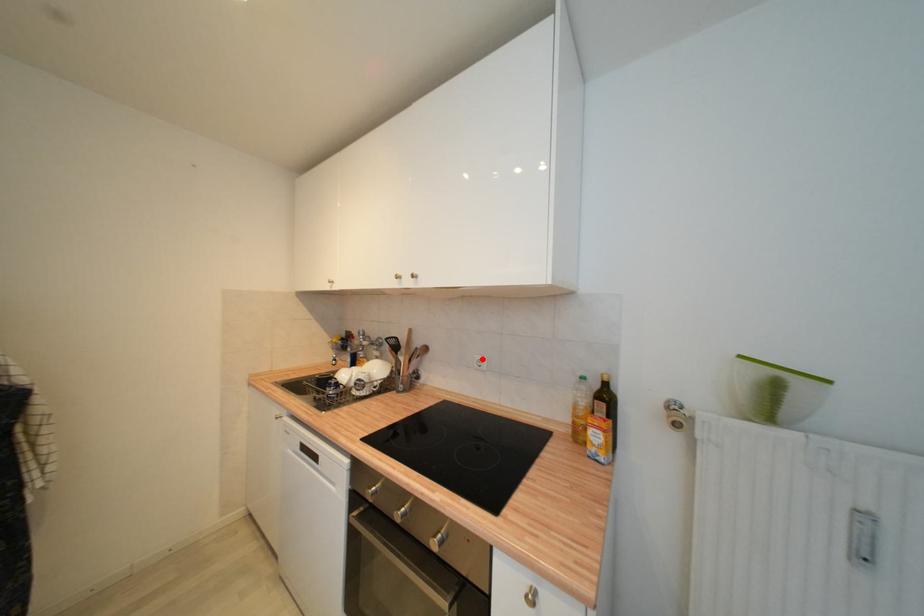
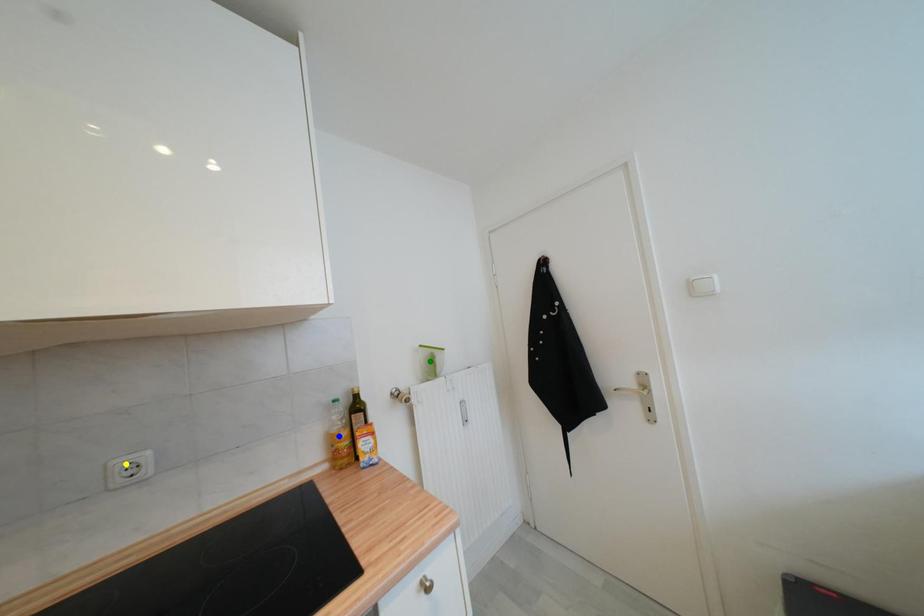
Question: I am providing you with two images of the same scene from different viewpoints. A red point is marked on the first image. You are given multiple points on the second image. Which spot in image 2 lines up with the point in image 1?

Choices:
 (A) green point
 (B) yellow point
 (C) blue point

Answer: (B)